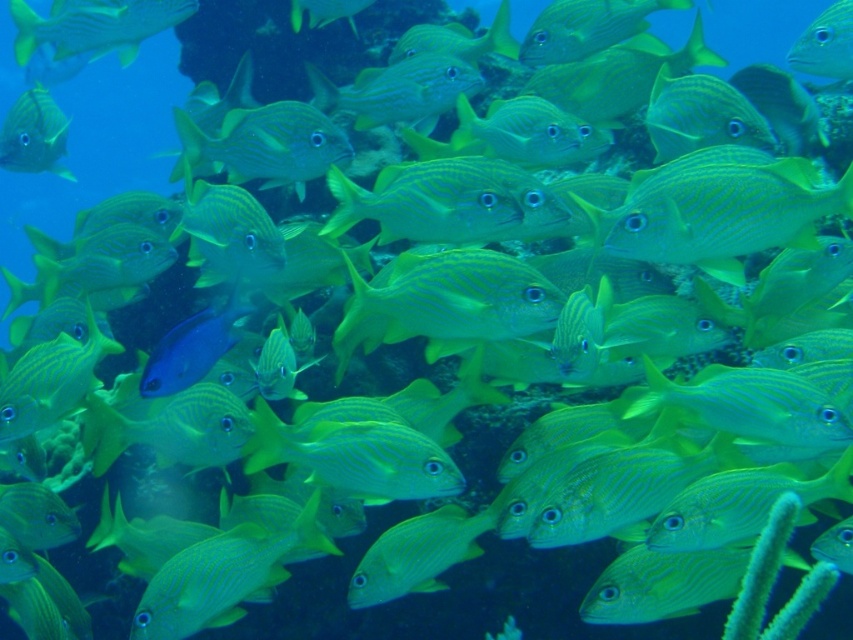
Question: Does green striped fish at center have a lesser width compared to green striped fish at upper left?

Choices:
 (A) no
 (B) yes

Answer: (B)

Question: Can you confirm if green striped fish at upper left is smaller than green striped fish at upper right?

Choices:
 (A) no
 (B) yes

Answer: (A)

Question: Which object appears closest to the camera in this image?

Choices:
 (A) matte yellow fish at upper left
 (B) green striped fish at center
 (C) green striped fish at upper right

Answer: (B)

Question: Does matte yellow fish at upper left have a greater width compared to green striped fish at upper right?

Choices:
 (A) no
 (B) yes

Answer: (B)

Question: Which is nearer to the green striped fish at center?

Choices:
 (A) green striped fish at upper right
 (B) green striped fish at upper left
 (C) matte yellow fish at upper left

Answer: (A)

Question: Which object is positioned closest to the green striped fish at upper right?

Choices:
 (A) green matte fish at center
 (B) matte yellow fish at upper left
 (C) green striped fish at upper left

Answer: (A)